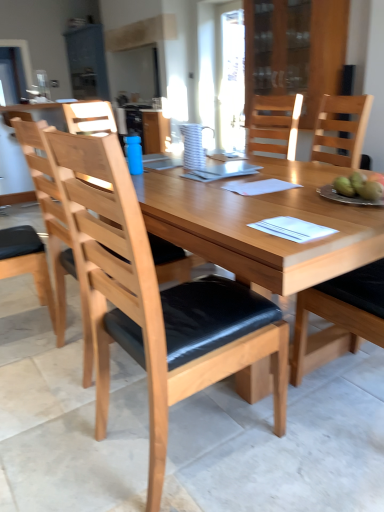
Question: Can you confirm if white striped pitcher at center is positioned to the right of blue matte bottle at center?

Choices:
 (A) no
 (B) yes

Answer: (B)

Question: Does white striped pitcher at center have a larger size compared to blue matte bottle at center?

Choices:
 (A) no
 (B) yes

Answer: (B)

Question: From the image's perspective, is white striped pitcher at center below blue matte bottle at center?

Choices:
 (A) no
 (B) yes

Answer: (A)

Question: Is white striped pitcher at center not within blue matte bottle at center?

Choices:
 (A) yes
 (B) no

Answer: (A)

Question: Is white striped pitcher at center not close to blue matte bottle at center?

Choices:
 (A) no
 (B) yes

Answer: (A)

Question: In the image, is transparent glass cabinet at upper center on the left side or the right side of light brown wood chair at center, positioned as the 1th chair in left-to-right order?

Choices:
 (A) left
 (B) right

Answer: (B)

Question: In terms of size, does transparent glass cabinet at upper center appear bigger or smaller than light brown wood chair at center, positioned as the 1th chair in left-to-right order?

Choices:
 (A) big
 (B) small

Answer: (A)

Question: From a real-world perspective, relative to light brown wood chair at center, the third chair from the right, is transparent glass cabinet at upper center vertically above or below?

Choices:
 (A) below
 (B) above

Answer: (B)

Question: Is transparent glass cabinet at upper center inside or outside of light brown wood chair at center, positioned as the 1th chair in left-to-right order?

Choices:
 (A) inside
 (B) outside

Answer: (B)

Question: From a real-world perspective, is metallic silver plate at right above or below transparent glass cabinet at upper center?

Choices:
 (A) below
 (B) above

Answer: (A)

Question: In terms of width, does metallic silver plate at right look wider or thinner when compared to transparent glass cabinet at upper center?

Choices:
 (A) thin
 (B) wide

Answer: (A)

Question: From their relative heights in the image, would you say metallic silver plate at right is taller or shorter than transparent glass cabinet at upper center?

Choices:
 (A) short
 (B) tall

Answer: (A)

Question: Looking at the image, does metallic silver plate at right seem bigger or smaller compared to transparent glass cabinet at upper center?

Choices:
 (A) big
 (B) small

Answer: (B)

Question: Is light wood/black cushion chair at center, the 2th chair viewed from the left, inside the boundaries of natural wood chair at right, which is the third chair from left to right, or outside?

Choices:
 (A) inside
 (B) outside

Answer: (B)

Question: Is point (177, 295) closer or farther from the camera than point (311, 338)?

Choices:
 (A) closer
 (B) farther

Answer: (A)